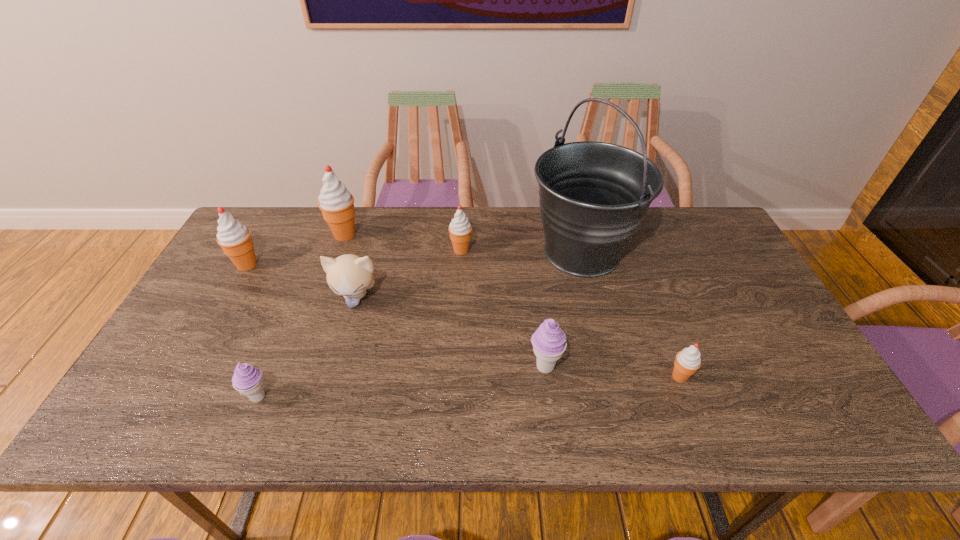
This screenshot has height=540, width=960. Find the location of `vacant space located 0.320m on the face of the kitten`. vacant space located 0.320m on the face of the kitten is located at coordinates (321, 422).

I want to click on vacant space located on the left of the smallest red icecream, so click(542, 376).

Where is `free region located on the left of the nearer purple icecream`? The image size is (960, 540). free region located on the left of the nearer purple icecream is located at coordinates (136, 397).

Where is `bucket situated at the far edge`? This screenshot has width=960, height=540. bucket situated at the far edge is located at coordinates (593, 195).

What are the coordinates of `object positioned at the near edge` in the screenshot? It's located at (247, 379).

Locate an element on the screen. This screenshot has width=960, height=540. object that is at the left edge is located at coordinates (234, 238).

The width and height of the screenshot is (960, 540). Identify the location of free space at the far edge of the desktop. (637, 237).

In the image, there is a desktop. Identify the location of free space at the near edge. (442, 417).

The image size is (960, 540). Find the location of `vacant space at the left edge of the desktop`. vacant space at the left edge of the desktop is located at coordinates (266, 266).

In the image, there is a desktop. In order to click on vacant space at the right edge in this screenshot , I will do `click(770, 319)`.